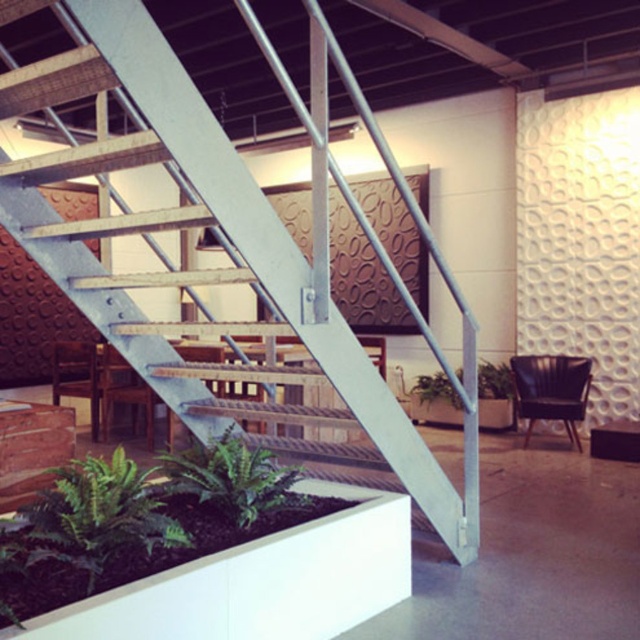
Which is more to the right, green leafy plant at lower center or wooden chair at center?

From the viewer's perspective, green leafy plant at lower center appears more on the right side.

Between point (282, 476) and point (122, 394), which one is positioned in front?

Positioned in front is point (282, 476).

Which is in front, point (170, 452) or point (115, 387)?

Point (170, 452) is more forward.

Where is `green leafy plant at lower center`? The image size is (640, 640). green leafy plant at lower center is located at coordinates (230, 477).

Is metallic staircase at center above wooden chair at center?

Yes, metallic staircase at center is above wooden chair at center.

Can you confirm if metallic staircase at center is positioned to the right of wooden chair at center?

Yes, metallic staircase at center is to the right of wooden chair at center.

Describe the element at coordinates (221, 237) in the screenshot. I see `metallic staircase at center` at that location.

The width and height of the screenshot is (640, 640). I want to click on metallic staircase at center, so click(x=221, y=237).

Is green leafy plant at lower left shorter than black leather chair at right?

Yes.

Who is taller, green leafy plant at lower left or black leather chair at right?

Standing taller between the two is black leather chair at right.

What do you see at coordinates (100, 513) in the screenshot? I see `green leafy plant at lower left` at bounding box center [100, 513].

This screenshot has width=640, height=640. I want to click on green leafy plant at lower left, so click(x=100, y=513).